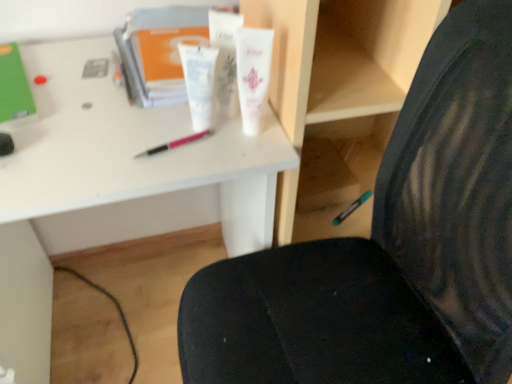
Find the location of a particular element. Image resolution: width=512 pixels, height=384 pixels. blank space to the left of white plastic book at upper center is located at coordinates (69, 64).